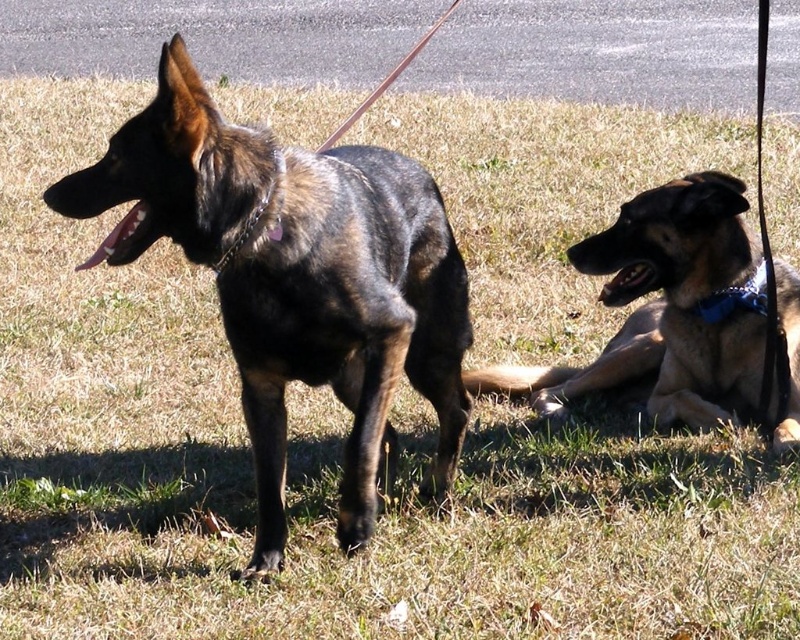
You are a photographer trying to capture both the brindle fur dog at center and the blue fabric neckband at right in a single shot. Based on their heights, which one should you focus on first to ensure both are in frame?

The brindle fur dog at center is taller than the blue fabric neckband at right, so you should focus on the brindle fur dog at center first to ensure both are in frame.

From the picture: You are a photographer standing at the center of the grassy area where the two dogs are. You want to take a photo that includes both the brindle fur dog at center and the brown fur dog at lower right. Given that your camera has a maximum focus range of 3 feet, will you be able to capture both dogs in focus without moving your position?

The brindle fur dog at center is 3.86 feet away from the brown fur dog at lower right. Since the distance between them exceeds the camera maximum focus range of 3 feet, you will not be able to capture both dogs in focus without moving your position.

You are standing at the point marked by the coordinates point [296,276]. Looking around, you see a brindle fur dog at center. Which direction should you face to look at the brindle fur dog at center?

You are already at the point on the brindle fur dog at center, so you are facing it directly.